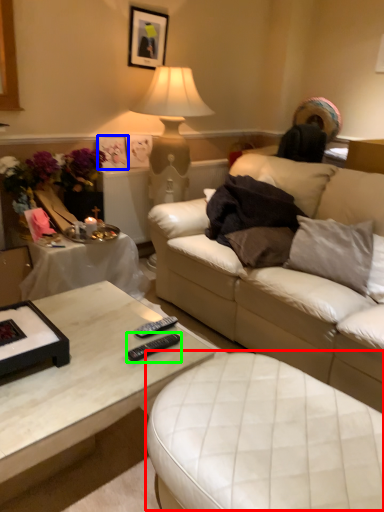
Question: Estimate the real-world distances between objects in this image. Which object is closer to swivel chair (highlighted by a red box), picture frame (highlighted by a blue box) or remote (highlighted by a green box)?

Choices:
 (A) picture frame
 (B) remote

Answer: (B)